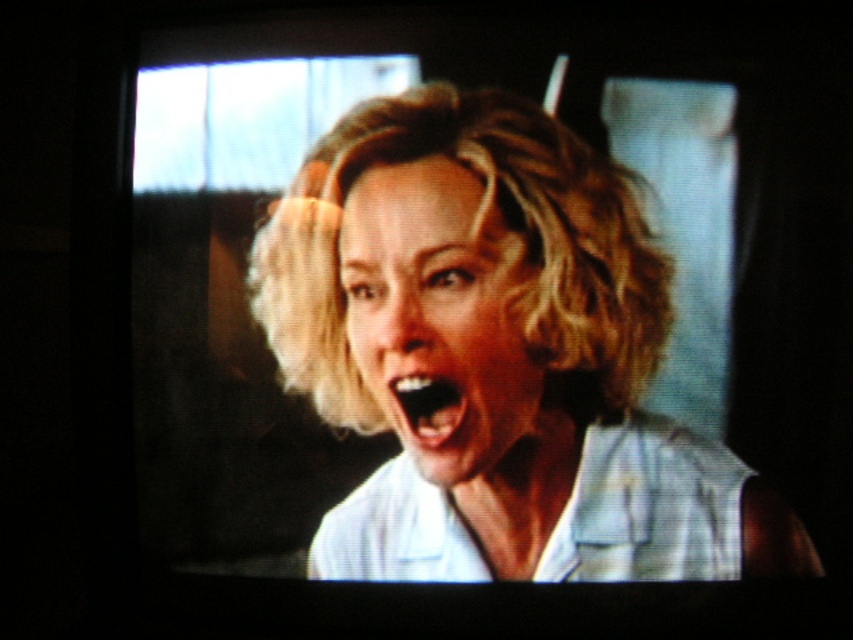
Question: Which point is closer to the camera?

Choices:
 (A) blonde hair at center
 (B) smooth white teeth at center

Answer: (A)

Question: Among these points, which one is farthest from the camera?

Choices:
 (A) (410, 376)
 (B) (517, 467)

Answer: (B)

Question: Can you confirm if white matte shirt at center is wider than blonde hair at center?

Choices:
 (A) no
 (B) yes

Answer: (B)

Question: Which point appears farthest from the camera in this image?

Choices:
 (A) (422, 396)
 (B) (421, 376)

Answer: (A)

Question: Can you confirm if blonde hair at center is smaller than smooth white teeth at center?

Choices:
 (A) no
 (B) yes

Answer: (A)

Question: Can you confirm if white matte shirt at center is positioned below smooth white teeth at center?

Choices:
 (A) yes
 (B) no

Answer: (A)